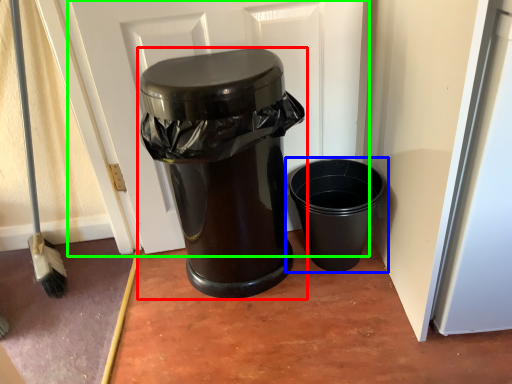
Question: Considering the real-world distances, which object is farthest from waste container (highlighted by a red box)? waste container (highlighted by a blue box) or screen door (highlighted by a green box)?

Choices:
 (A) waste container
 (B) screen door

Answer: (A)